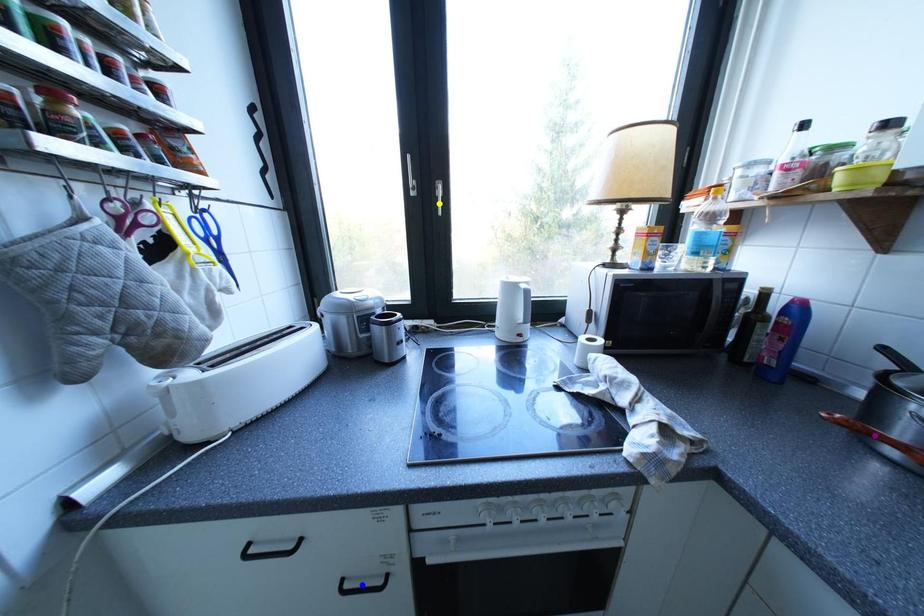
Consider the image. Order these from nearest to farthest:
A) yellow point
B) blue point
C) purple point

purple point, blue point, yellow point